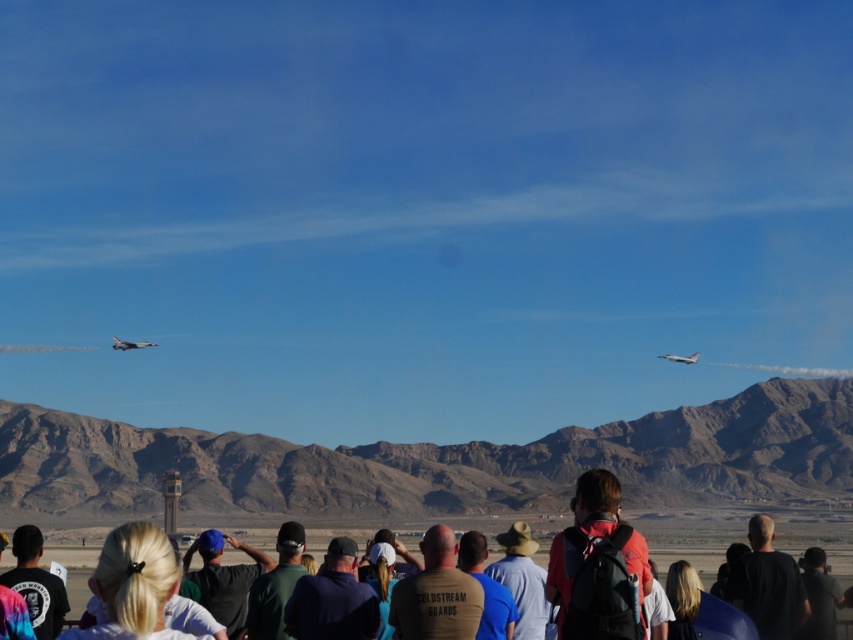
Which is in front, point (822, 508) or point (695, 358)?

Point (822, 508)

Can you confirm if dark brown shirt at center is positioned below shiny silver jet at upper center?

Indeed, dark brown shirt at center is positioned under shiny silver jet at upper center.

Is point (809, 532) farther from camera compared to point (668, 356)?

No, (809, 532) is in front of (668, 356).

I want to click on dark brown shirt at center, so click(744, 531).

Does silver metallic jet at upper left have a greater height compared to shiny silver jet at upper center?

Correct, silver metallic jet at upper left is much taller as shiny silver jet at upper center.

Does silver metallic jet at upper left appear on the right side of shiny silver jet at upper center?

Incorrect, silver metallic jet at upper left is not on the right side of shiny silver jet at upper center.

What do you see at coordinates (129, 342) in the screenshot? I see `silver metallic jet at upper left` at bounding box center [129, 342].

Locate an element on the screen. The image size is (853, 640). silver metallic jet at upper left is located at coordinates (129, 342).

Is black matte shirt at lower right to the right of shiny silver jet at upper center from the viewer's perspective?

No, black matte shirt at lower right is not to the right of shiny silver jet at upper center.

Can you confirm if black matte shirt at lower right is wider than shiny silver jet at upper center?

Yes, black matte shirt at lower right is wider than shiny silver jet at upper center.

Is point (752, 536) farther from camera compared to point (695, 355)?

No, (752, 536) is in front of (695, 355).

This screenshot has width=853, height=640. Identify the location of black matte shirt at lower right. (767, 584).